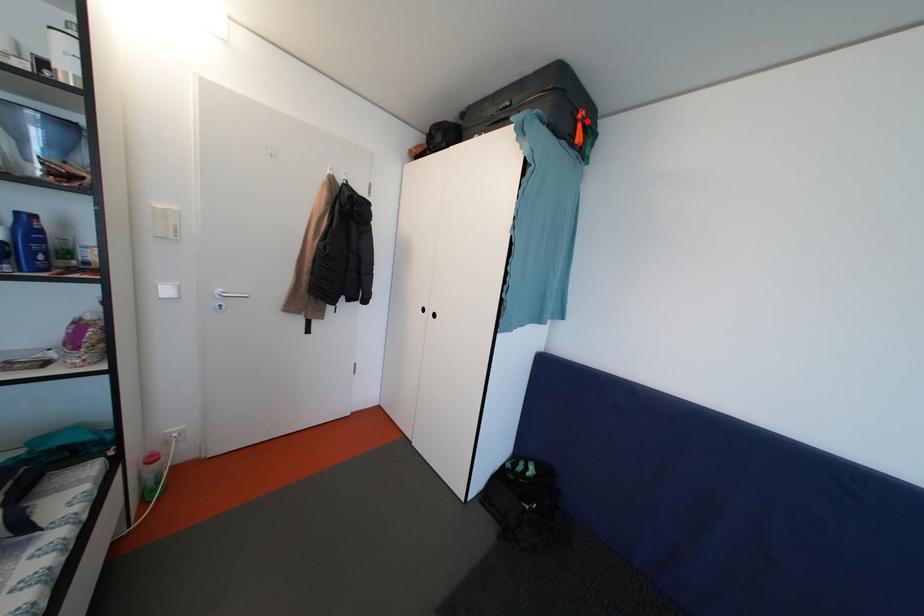
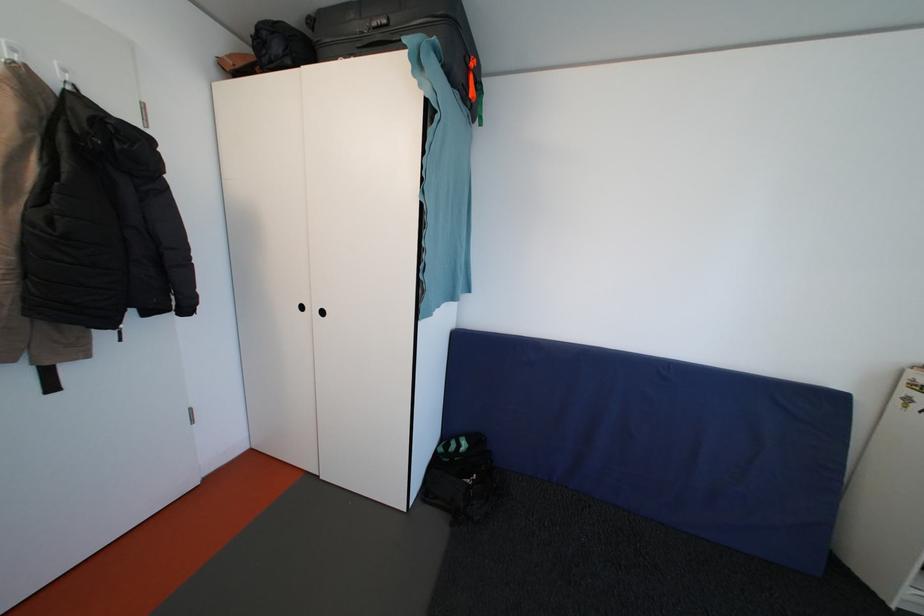
Where in the second image is the point corresponding to the highlighted location from the first image?

(479, 70)